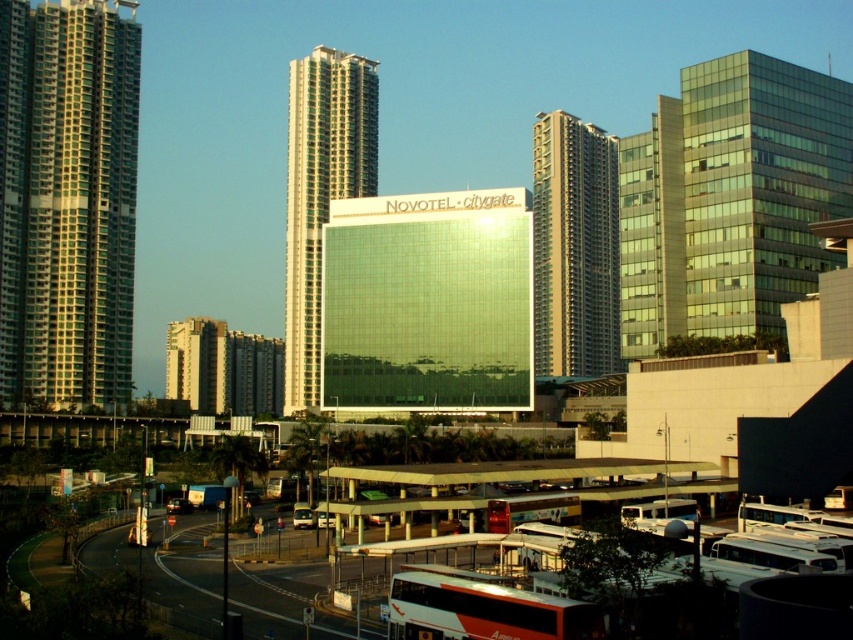
Is green glass building at center bigger than light beige concrete building at left?

No.

Who is more distant from viewer, (305, 376) or (202, 403)?

The point (202, 403) is more distant.

You are a GUI agent. You are given a task and a screenshot of the screen. Output one action in this format:
    pyautogui.click(x=<x>, y=<y>)
    Task: Click on the green glass building at center
    Image resolution: width=853 pixels, height=640 pixels.
    Given the screenshot: What is the action you would take?
    pyautogui.click(x=321, y=193)

Describe the element at coordinates (321, 193) in the screenshot. I see `green glass building at center` at that location.

Which is in front, point (368, 176) or point (682, 250)?

Point (682, 250) is more forward.

Which is behind, point (317, 339) or point (628, 150)?

The point (317, 339) is more distant.

You are a GUI agent. You are given a task and a screenshot of the screen. Output one action in this format:
    pyautogui.click(x=<x>, y=<y>)
    Task: Click on the green glass building at center
    This screenshot has width=853, height=640.
    Given the screenshot: What is the action you would take?
    pyautogui.click(x=321, y=193)

I want to click on light beige concrete building at left, so click(x=196, y=364).

Is point (219, 385) behind point (646, 512)?

Yes, it is behind point (646, 512).

This screenshot has width=853, height=640. I want to click on light beige concrete building at left, so click(x=196, y=364).